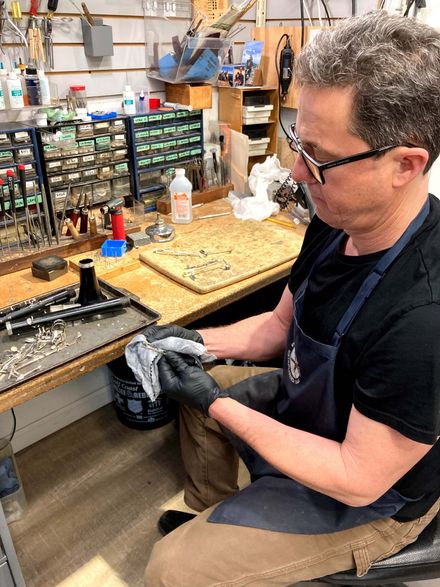
You are a GUI agent. You are given a task and a screenshot of the screen. Output one action in this format:
    pyautogui.click(x=<x>, y=<y>)
    Task: Click on the wood table
    The image size is (440, 587).
    Given the screenshot: What is the action you would take?
    pyautogui.click(x=174, y=310)